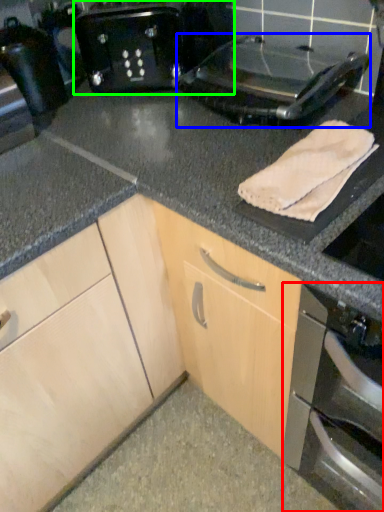
Question: Which is nearer to the home appliance (highlighted by a red box)? kitchen appliance (highlighted by a blue box) or toaster (highlighted by a green box).

Choices:
 (A) kitchen appliance
 (B) toaster

Answer: (A)